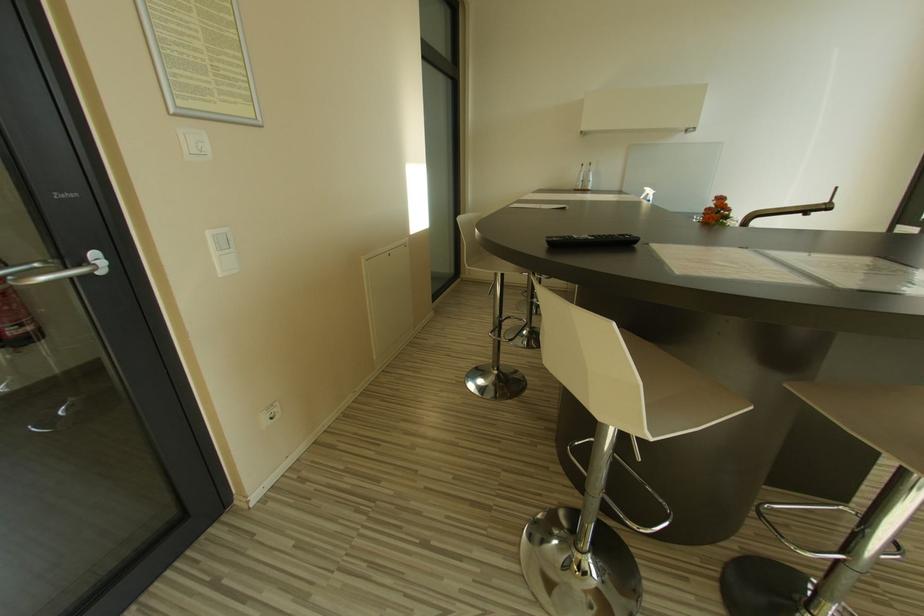
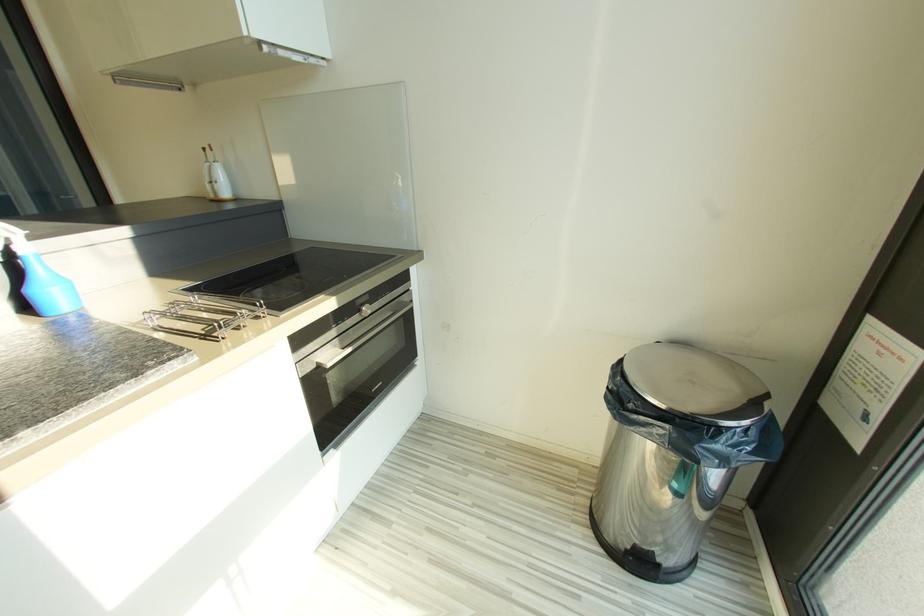
What movement of the cameraman would produce the second image?

The movement direction of the cameraman is right, forward.